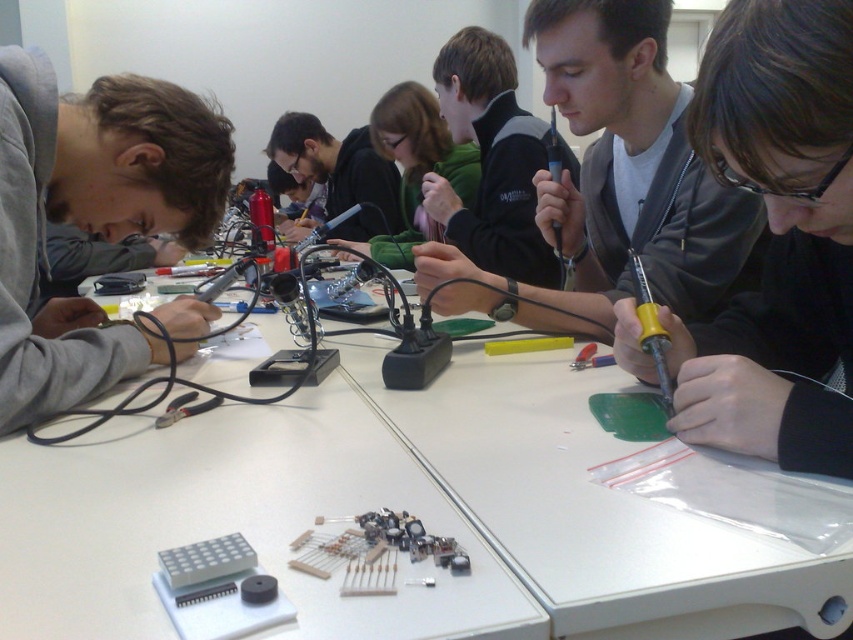
You are a photographer standing at a certain distance from the white plastic table at center. You want to take a closeup shot of the electronic components on the table. Is the table within the recommended 20 inches focal length for your camera lens? Please answer based on the distance provided.

The white plastic table at center is 20.53 inches from the camera, which exceeds the recommended 20 inches focal length. Therefore, the table is slightly out of the optimal range for a closeup shot.

You are organizing the tools on the table for a workshop. You need to place the matte black soldering iron at center and the yellow plastic screwdriver at center right into a drawer that is 15 cm wide. Can both fit side by side without overlapping?

The matte black soldering iron at center might be wider than yellow plastic screwdriver at center right. Since the drawer is 15 cm wide, it depends on their combined widths. If the soldering iron is wider, their total width could exceed 15 cm, so they might not fit. Check their actual dimensions to be sure.

You are a participant in the electronics workshop and need to retrieve a screwdriver. You see the matte black screwdriver at center and the yellow plastic screwdriver at center right. Which one is positioned higher on the table?

The matte black screwdriver at center is positioned higher on the table because it is above the yellow plastic screwdriver at center right.